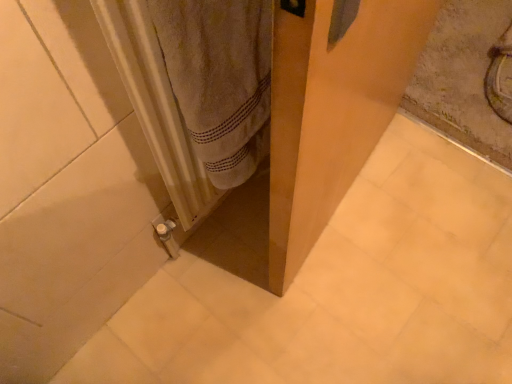
Question: Is transparent plastic screen door at center taller or shorter than white textured radiator at lower left?

Choices:
 (A) short
 (B) tall

Answer: (B)

Question: From the image's perspective, is transparent plastic screen door at center positioned above or below white textured radiator at lower left?

Choices:
 (A) below
 (B) above

Answer: (B)

Question: Visually, is transparent plastic screen door at center positioned to the left or to the right of white textured radiator at lower left?

Choices:
 (A) left
 (B) right

Answer: (B)

Question: Is white textured radiator at lower left bigger or smaller than transparent plastic screen door at center?

Choices:
 (A) big
 (B) small

Answer: (B)

Question: Visually, is white textured radiator at lower left positioned to the left or to the right of transparent plastic screen door at center?

Choices:
 (A) right
 (B) left

Answer: (B)

Question: From the image's perspective, is white textured radiator at lower left positioned above or below transparent plastic screen door at center?

Choices:
 (A) below
 (B) above

Answer: (A)

Question: From a real-world perspective, is white textured radiator at lower left physically located above or below transparent plastic screen door at center?

Choices:
 (A) above
 (B) below

Answer: (A)